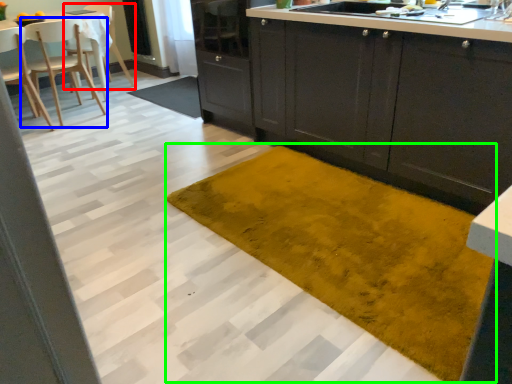
Question: Which object is positioned closest to chair (highlighted by a red box)? Select from chair (highlighted by a blue box) and doormat (highlighted by a green box).

Choices:
 (A) chair
 (B) doormat

Answer: (A)